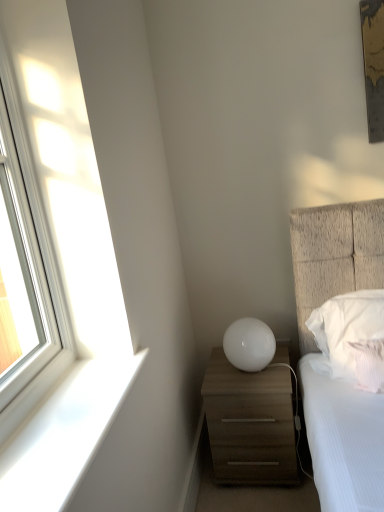
The height and width of the screenshot is (512, 384). What do you see at coordinates (249, 344) in the screenshot?
I see `white glossy sphere at center` at bounding box center [249, 344].

Locate an element on the screen. white soft pillow at right, placed as the first pillow when sorted from back to front is located at coordinates pyautogui.click(x=346, y=330).

Can you confirm if white soft pillow at right, the second pillow from the front, is taller than matte wood chest of drawers at lower right?

No, white soft pillow at right, the second pillow from the front, is not taller than matte wood chest of drawers at lower right.

I want to click on the chest of drawers below the white soft pillow at right, placed as the first pillow when sorted from back to front (from the image's perspective), so click(250, 423).

From the image's perspective, relative to matte wood chest of drawers at lower right, is white soft pillow at right, the second pillow from the front, above or below?

white soft pillow at right, the second pillow from the front, is above matte wood chest of drawers at lower right.

From a real-world perspective, who is located higher, matte wood chest of drawers at lower right or white glossy window sill at left?

white glossy window sill at left.

Can you tell me how much matte wood chest of drawers at lower right and white glossy window sill at left differ in facing direction?

89.8 degrees separate the facing orientations of matte wood chest of drawers at lower right and white glossy window sill at left.

Looking at this image, is matte wood chest of drawers at lower right in front of or behind white glossy window sill at left in the image?

In the image, matte wood chest of drawers at lower right appears behind white glossy window sill at left.

Which of these two, matte wood chest of drawers at lower right or white glossy window sill at left, is thinner?

Thinner between the two is white glossy window sill at left.

Considering the relative positions of matte wood chest of drawers at lower right and clear glass window at left in the image provided, is matte wood chest of drawers at lower right to the left or to the right of clear glass window at left?

matte wood chest of drawers at lower right is positioned on clear glass window at left's right side.

Are matte wood chest of drawers at lower right and clear glass window at left far apart?

No.

Looking at this image, between matte wood chest of drawers at lower right and clear glass window at left, which one has larger size?

matte wood chest of drawers at lower right is bigger.

Considering the relative sizes of matte wood chest of drawers at lower right and clear glass window at left in the image provided, is matte wood chest of drawers at lower right wider than clear glass window at left?

Indeed, matte wood chest of drawers at lower right has a greater width compared to clear glass window at left.

Between matte wood chest of drawers at lower right and white glossy sphere at center, which one is positioned behind?

white glossy sphere at center is more distant.

This screenshot has width=384, height=512. In order to click on table lamp above the matte wood chest of drawers at lower right (from a real-world perspective) in this screenshot , I will do `click(249, 344)`.

Is matte wood chest of drawers at lower right not near white glossy sphere at center?

matte wood chest of drawers at lower right is actually quite close to white glossy sphere at center.

From the image's perspective, relative to white glossy sphere at center, is matte wood chest of drawers at lower right above or below?

From the image's perspective, matte wood chest of drawers at lower right appears below white glossy sphere at center.

From the image's perspective, is white soft pillow at right, placed as the first pillow when sorted from back to front, below white textured pillow at right, arranged as the first pillow when viewed from the front?

Actually, white soft pillow at right, placed as the first pillow when sorted from back to front, appears above white textured pillow at right, arranged as the first pillow when viewed from the front, in the image.

Considering the relative sizes of white soft pillow at right, placed as the first pillow when sorted from back to front, and white textured pillow at right, arranged as the first pillow when viewed from the front, in the image provided, is white soft pillow at right, placed as the first pillow when sorted from back to front, taller than white textured pillow at right, arranged as the first pillow when viewed from the front,?

Indeed, white soft pillow at right, placed as the first pillow when sorted from back to front, has a greater height compared to white textured pillow at right, arranged as the first pillow when viewed from the front.

Between point (341, 357) and point (378, 372), which one is positioned in front?

The point (378, 372) is more forward.

Measure the distance from white soft pillow at right, placed as the first pillow when sorted from back to front, to white textured pillow at right, which is the second pillow from back to front.

white soft pillow at right, placed as the first pillow when sorted from back to front, is 4.13 inches from white textured pillow at right, which is the second pillow from back to front.

Could you tell me if white glossy sphere at center is facing white glossy window sill at left?

Yes, white glossy sphere at center is oriented towards white glossy window sill at left.

Which object is closer to the camera, white glossy sphere at center or white glossy window sill at left?

white glossy window sill at left is closer to the camera.

Is white glossy sphere at center inside or outside of white glossy window sill at left?

white glossy sphere at center is located beyond the bounds of white glossy window sill at left.

Is white glossy sphere at center far from white glossy window sill at left?

white glossy sphere at center is near white glossy window sill at left, not far away.

Identify the location of window sill in front of the white soft pillow at right, placed as the first pillow when sorted from back to front. The image size is (384, 512). (64, 435).

Is white glossy window sill at left oriented towards white soft pillow at right, the second pillow from the front?

No.

Which object is thinner, white glossy window sill at left or white soft pillow at right, the second pillow from the front?

white soft pillow at right, the second pillow from the front.

Considering the relative positions of white glossy window sill at left and white soft pillow at right, the second pillow from the front, in the image provided, is white glossy window sill at left to the right of white soft pillow at right, the second pillow from the front, from the viewer's perspective?

Incorrect, white glossy window sill at left is not on the right side of white soft pillow at right, the second pillow from the front.

You are a GUI agent. You are given a task and a screenshot of the screen. Output one action in this format:
    pyautogui.click(x=<x>, y=<y>)
    Task: Click on the 1st pillow counting from the right of the matte wood chest of drawers at lower right
    This screenshot has width=384, height=512.
    Given the screenshot: What is the action you would take?
    pyautogui.click(x=346, y=330)

Find the location of `window sill located above the matte wood chest of drawers at lower right (from the image's perspective)`. window sill located above the matte wood chest of drawers at lower right (from the image's perspective) is located at coordinates [x=64, y=435].

When comparing their distances from white glossy sphere at center, does matte wood chest of drawers at lower right or white soft pillow at right, placed as the first pillow when sorted from back to front, seem further?

white soft pillow at right, placed as the first pillow when sorted from back to front.

Which object lies nearer to the anchor point white glossy sphere at center, white glossy window sill at left or matte wood chest of drawers at lower right?

Based on the image, matte wood chest of drawers at lower right appears to be nearer to white glossy sphere at center.

Looking at this image, when comparing their distances from matte wood chest of drawers at lower right, does white soft pillow at right, the second pillow from the front, or white textured pillow at right, which is the second pillow from back to front, seem further?

white textured pillow at right, which is the second pillow from back to front, lies further to matte wood chest of drawers at lower right than the other object.

Looking at the image, which one is located further to white textured pillow at right, which is the second pillow from back to front, clear glass window at left or white glossy window sill at left?

The object further to white textured pillow at right, which is the second pillow from back to front, is clear glass window at left.

Considering their positions, is white textured pillow at right, which is the second pillow from back to front, positioned closer to matte wood chest of drawers at lower right than white glossy window sill at left?

Among the two, white textured pillow at right, which is the second pillow from back to front, is located nearer to matte wood chest of drawers at lower right.

Looking at the image, which one is located closer to white textured pillow at right, arranged as the first pillow when viewed from the front, white glossy window sill at left or white glossy sphere at center?

white glossy sphere at center lies closer to white textured pillow at right, arranged as the first pillow when viewed from the front, than the other object.

Based on their spatial positions, is white textured pillow at right, arranged as the first pillow when viewed from the front, or clear glass window at left closer to white soft pillow at right, the second pillow from the front?

The object closer to white soft pillow at right, the second pillow from the front, is white textured pillow at right, arranged as the first pillow when viewed from the front.

Looking at the image, which one is located closer to matte wood chest of drawers at lower right, white textured pillow at right, which is the second pillow from back to front, or white glossy sphere at center?

white glossy sphere at center is closer to matte wood chest of drawers at lower right.

This screenshot has width=384, height=512. In order to click on chest of drawers between clear glass window at left and white glossy sphere at center from front to back in this screenshot , I will do pos(250,423).

This screenshot has height=512, width=384. I want to click on chest of drawers between white glossy window sill at left and white glossy sphere at center along the z-axis, so click(250, 423).

You are a GUI agent. You are given a task and a screenshot of the screen. Output one action in this format:
    pyautogui.click(x=<x>, y=<y>)
    Task: Click on the window sill positioned between clear glass window at left and matte wood chest of drawers at lower right from near to far
    This screenshot has width=384, height=512.
    Given the screenshot: What is the action you would take?
    pyautogui.click(x=64, y=435)

Where is `table lamp between clear glass window at left and white soft pillow at right, the second pillow from the front, from left to right`? table lamp between clear glass window at left and white soft pillow at right, the second pillow from the front, from left to right is located at coordinates (249, 344).